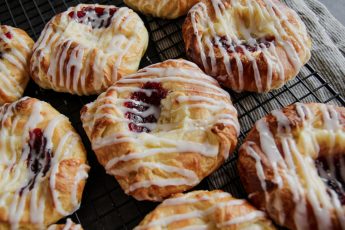
This screenshot has height=230, width=345. In order to click on edge of cooling rack in this screenshot , I will do coord(331,88).